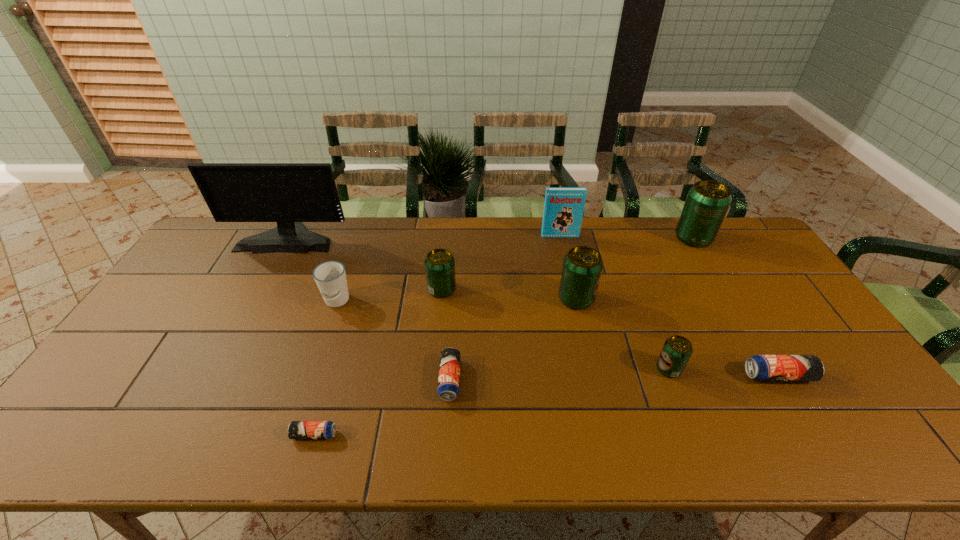
You are a GUI agent. You are given a task and a screenshot of the screen. Output one action in this format:
    pyautogui.click(x=<x>, y=<y>)
    Task: Click on the vacant area situated on the left of the second biggest green beer can
    The height and width of the screenshot is (540, 960).
    Given the screenshot: What is the action you would take?
    pyautogui.click(x=512, y=299)

The height and width of the screenshot is (540, 960). What are the coordinates of `vacant space situated 0.360m on the left of the second smallest green beer can` in the screenshot? It's located at (311, 289).

Find the location of a particular element. The width and height of the screenshot is (960, 540). vacant space situated 0.140m with a handle on the side of the cup is located at coordinates (320, 353).

Identify the location of vacant space situated on the front of the third green beer can from left to right. (696, 439).

Image resolution: width=960 pixels, height=540 pixels. In order to click on vacant space located 0.140m on the front of the eighth tallest object in this screenshot , I will do `click(817, 440)`.

Find the location of `free space located on the front of the second shortest object`. free space located on the front of the second shortest object is located at coordinates (446, 429).

Identify the location of vacant space located 0.060m on the left of the nearest beer can. (266, 435).

Locate an element on the screen. This screenshot has height=540, width=960. monitor that is at the far edge is located at coordinates (287, 193).

What are the coordinates of `beer can that is at the far edge` in the screenshot? It's located at (707, 202).

In order to click on book that is at the far edge in this screenshot , I will do `click(563, 210)`.